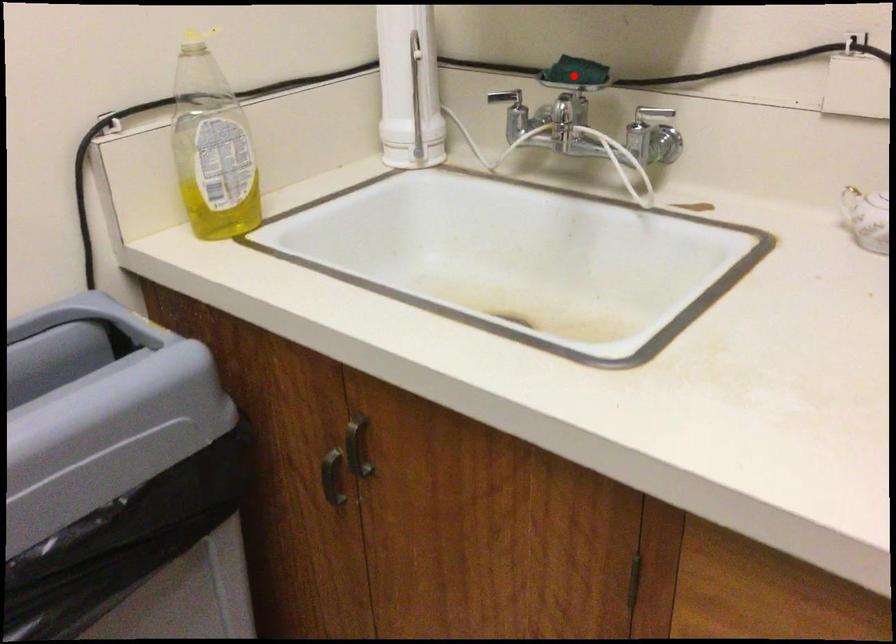
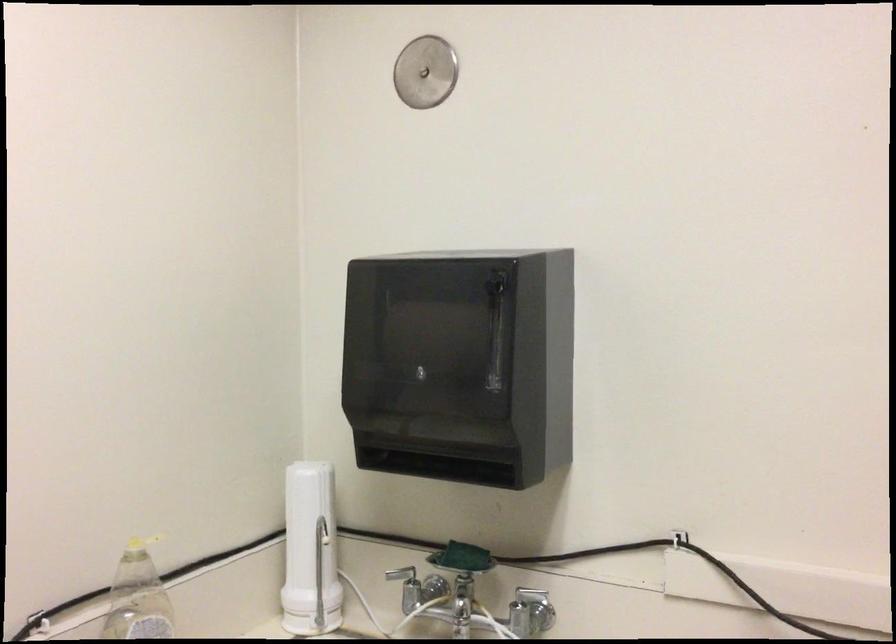
Question: I am providing you with two images of the same scene from different viewpoints. In image1, a red point is highlighted. Considering the same 3D point in image2, which of the following is correct?

Choices:
 (A) It is closer
 (B) It is farther

Answer: (B)